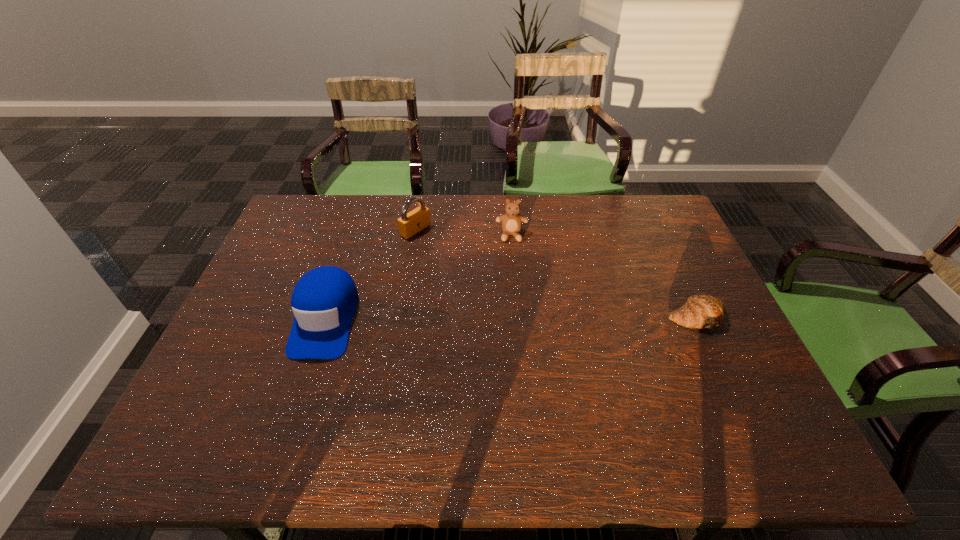
Find the location of `free space located on the front-facing side of the second object from right to left`. free space located on the front-facing side of the second object from right to left is located at coordinates 514,335.

I want to click on vacant position located 0.160m on the front-facing side of the second object from right to left, so click(x=513, y=278).

Locate an element on the screen. The image size is (960, 540). padlock that is at the far edge is located at coordinates (411, 223).

Where is `teddy bear that is at the far edge`? teddy bear that is at the far edge is located at coordinates (512, 221).

This screenshot has height=540, width=960. What are the coordinates of `object positioned at the right edge` in the screenshot? It's located at (704, 311).

In the image, there is a desktop. Where is `vacant space at the far edge`? The width and height of the screenshot is (960, 540). vacant space at the far edge is located at coordinates (614, 212).

Find the location of `vacant region at the near edge of the desktop`. vacant region at the near edge of the desktop is located at coordinates (552, 389).

In the image, there is a desktop. Identify the location of vacant space at the left edge. The height and width of the screenshot is (540, 960). (282, 339).

At what (x,y) coordinates should I click in order to perform the action: click on vacant space at the right edge of the desktop. Please return your answer as a coordinate pair (x, y). Looking at the image, I should click on (673, 259).

Find the location of `vacant space at the far right corner of the desktop`. vacant space at the far right corner of the desktop is located at coordinates (651, 198).